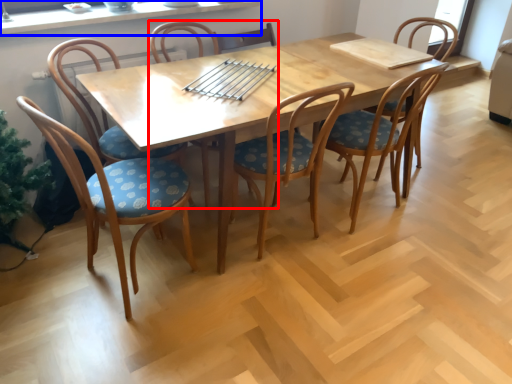
Question: Which of the following is the closest to the observer, chair (highlighted by a red box) or window sill (highlighted by a blue box)?

Choices:
 (A) chair
 (B) window sill

Answer: (A)